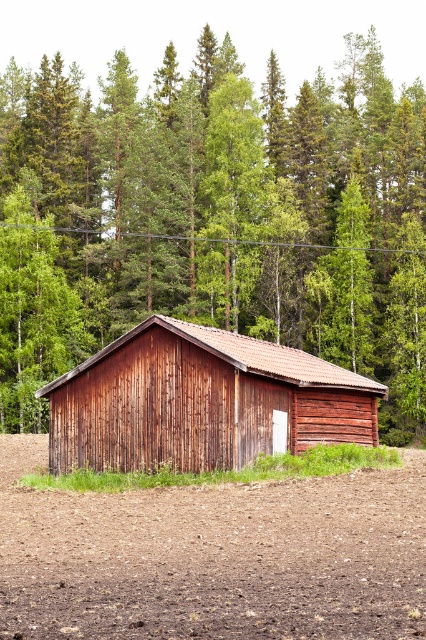
Question: Among these objects, which one is farthest from the camera?

Choices:
 (A) brown soil at lower center
 (B) brown wooden house at center

Answer: (B)

Question: Where is brown soil at lower center located in relation to wooden barn at center in the image?

Choices:
 (A) right
 (B) left

Answer: (B)

Question: Can you confirm if brown soil at lower center is positioned below wooden barn at center?

Choices:
 (A) yes
 (B) no

Answer: (A)

Question: Which of the following is the closest to the observer?

Choices:
 (A) (149, 467)
 (B) (232, 227)

Answer: (A)

Question: Observing the image, what is the correct spatial positioning of brown soil at lower center in reference to wooden barn at center?

Choices:
 (A) left
 (B) right

Answer: (A)

Question: Among these objects, which one is nearest to the camera?

Choices:
 (A) brown wooden house at center
 (B) brown soil at lower center

Answer: (B)